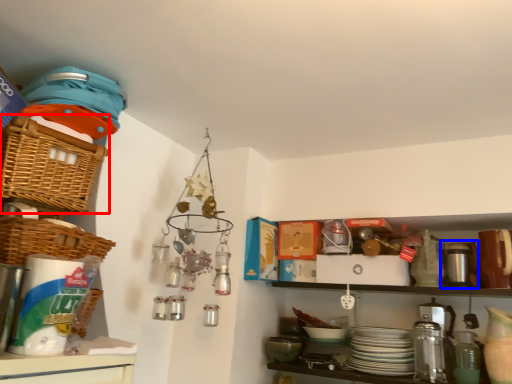
Question: Among these objects, which one is farthest to the camera, basket (highlighted by a red box) or appliance (highlighted by a blue box)?

Choices:
 (A) basket
 (B) appliance

Answer: (B)